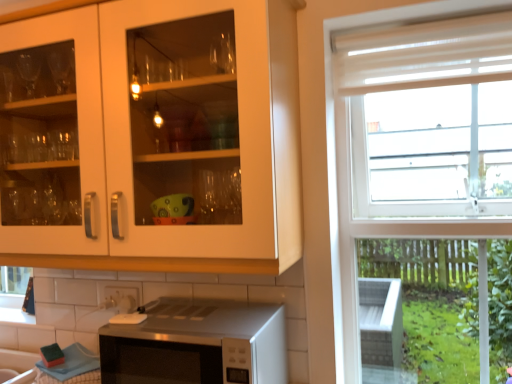
Question: Visually, is white glossy tile at lower center positioned to the left or to the right of satin silver microwave at lower center?

Choices:
 (A) right
 (B) left

Answer: (B)

Question: Is point (134, 286) positioned closer to the camera than point (281, 370)?

Choices:
 (A) closer
 (B) farther

Answer: (B)

Question: Based on their relative distances, which object is farther from the satin silver microwave at lower center?

Choices:
 (A) matte white cabinet at upper left
 (B) sheer white curtain at upper right
 (C) white glossy tile at lower center

Answer: (B)

Question: Estimate the real-world distances between objects in this image. Which object is closer to the satin silver microwave at lower center?

Choices:
 (A) sheer white curtain at upper right
 (B) white glossy tile at lower center
 (C) matte white cabinet at upper left

Answer: (C)